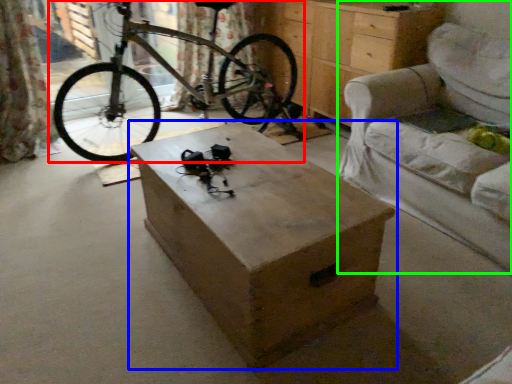
Question: Estimate the real-world distances between objects in this image. Which object is farther from bicycle (highlighted by a red box), table (highlighted by a blue box) or armchair (highlighted by a green box)?

Choices:
 (A) table
 (B) armchair

Answer: (B)